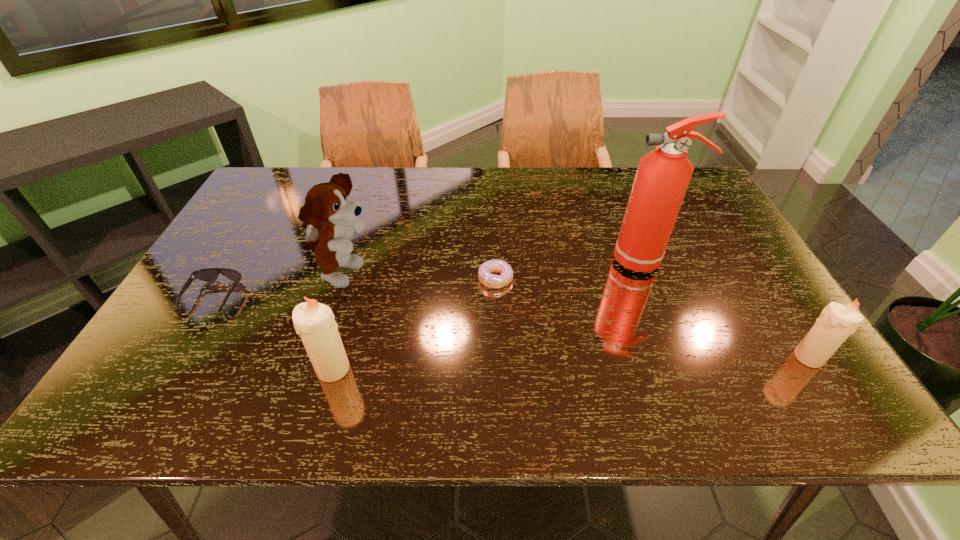
I want to click on blank area located on the left of the third shortest object, so pos(761,357).

Locate an element on the screen. vacant space located on the right of the fourth object from left to right is located at coordinates (636, 279).

What are the coordinates of `vacant space located at the nozzle of the fire extinguisher` in the screenshot? It's located at (580, 260).

Image resolution: width=960 pixels, height=540 pixels. Find the location of `vacant space located at the nozzle of the fire extinguisher`. vacant space located at the nozzle of the fire extinguisher is located at coordinates (468, 260).

In order to click on vacant space located 0.140m at the nozzle of the fire extinguisher in this screenshot , I will do `click(561, 260)`.

At what (x,y) coordinates should I click in order to perform the action: click on vacant space situated on the front-facing side of the leftmost object. Please return your answer as a coordinate pair (x, y). The width and height of the screenshot is (960, 540). Looking at the image, I should click on (170, 371).

Image resolution: width=960 pixels, height=540 pixels. What are the coordinates of `vacant region located on the face of the puppy` in the screenshot? It's located at (526, 275).

At what (x,y) coordinates should I click in order to perform the action: click on object present at the left edge. Please return your answer as a coordinate pair (x, y). This screenshot has width=960, height=540. Looking at the image, I should click on (208, 274).

Locate an element on the screen. Image resolution: width=960 pixels, height=540 pixels. object present at the right edge is located at coordinates (837, 322).

You are a GUI agent. You are given a task and a screenshot of the screen. Output one action in this format:
    pyautogui.click(x=<x>, y=<y>)
    Task: Click on the object located at the near right corner
    This screenshot has width=960, height=540.
    Given the screenshot: What is the action you would take?
    pyautogui.click(x=837, y=322)